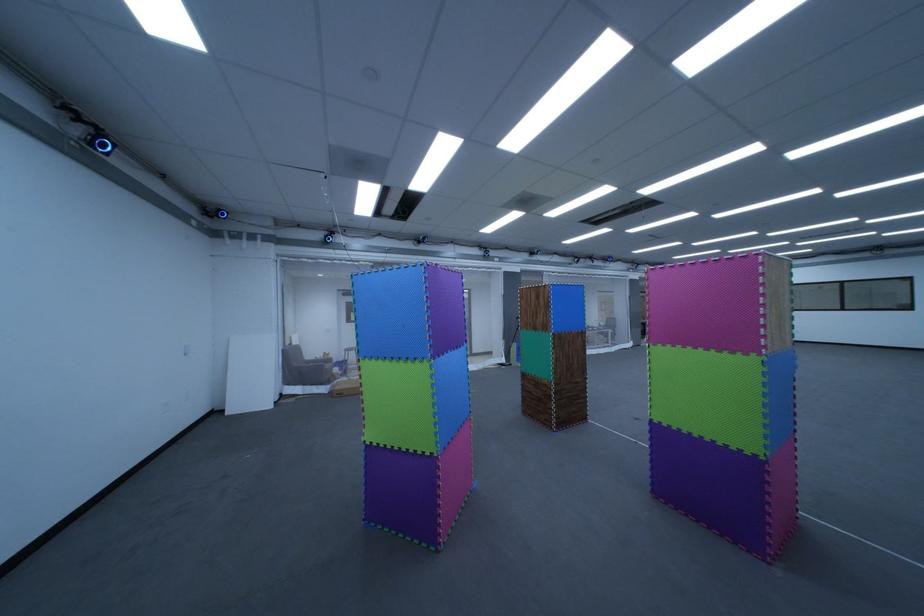
Locate an element on the screen. green foam tile is located at coordinates (709, 395).